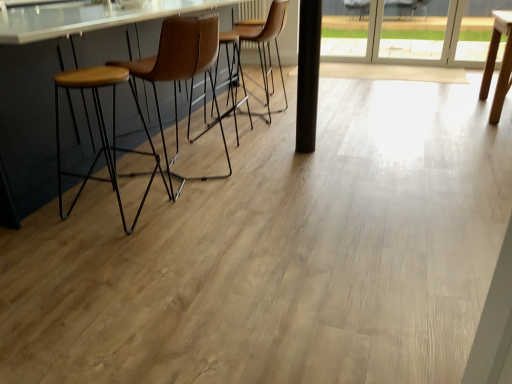
Identify the location of vacant area on the back side of brown leather stool at left, the first chair when ordered from front to back. (212, 139).